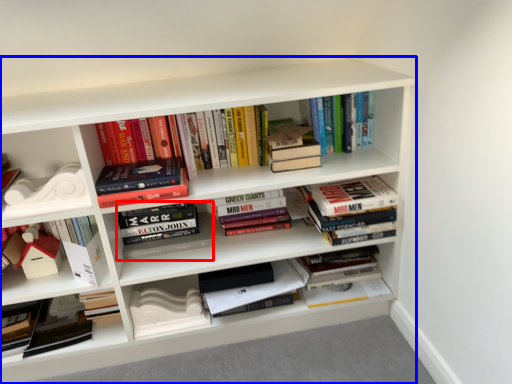
Question: Among these objects, which one is farthest to the camera, book (highlighted by a red box) or shelf (highlighted by a blue box)?

Choices:
 (A) book
 (B) shelf

Answer: (A)